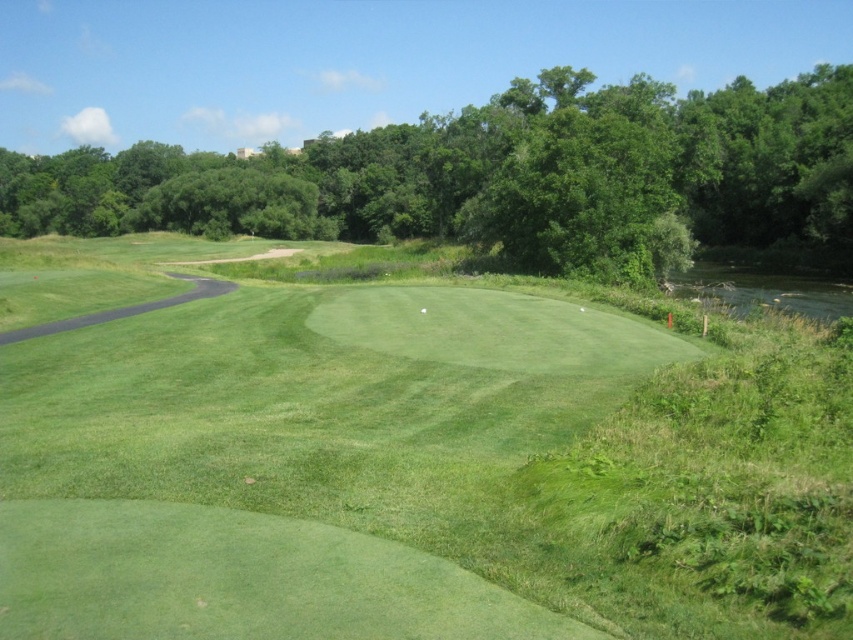
Question: Does green grassy golf course at center appear under green leafy tree at upper center?

Choices:
 (A) no
 (B) yes

Answer: (B)

Question: Which object is closer to the camera taking this photo?

Choices:
 (A) green leafy tree at upper center
 (B) green grassy golf course at center

Answer: (B)

Question: Among these points, which one is farthest from the camera?

Choices:
 (A) (408, 289)
 (B) (318, 214)

Answer: (B)

Question: Is green grassy golf course at center to the right of green leafy tree at upper center from the viewer's perspective?

Choices:
 (A) yes
 (B) no

Answer: (B)

Question: Which object is closer to the camera taking this photo?

Choices:
 (A) green grassy golf course at center
 (B) green leafy tree at upper center

Answer: (A)

Question: Does green grassy golf course at center have a larger size compared to green leafy tree at upper center?

Choices:
 (A) no
 (B) yes

Answer: (A)